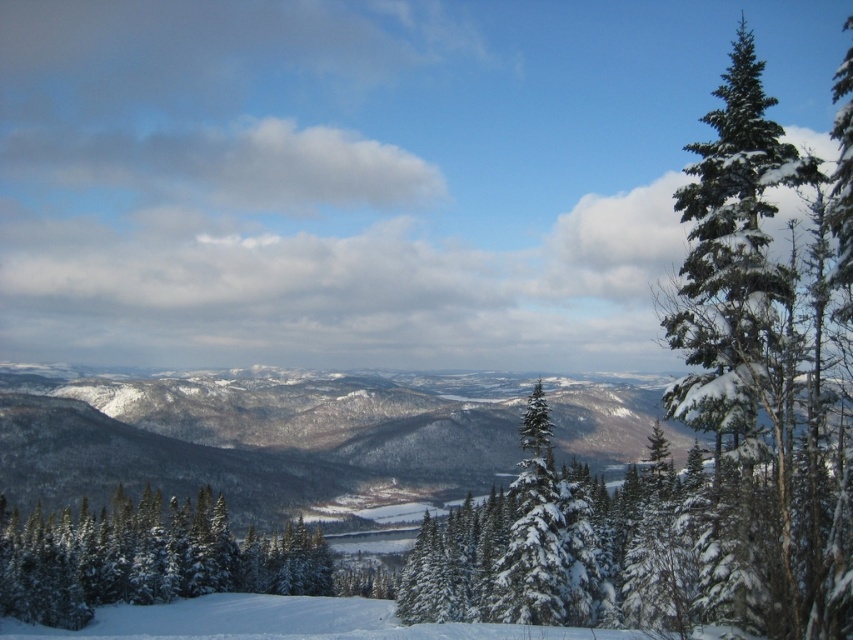
Can you confirm if green snow-covered evergreen at right is positioned to the left of white snow-covered trees at lower left?

No, green snow-covered evergreen at right is not to the left of white snow-covered trees at lower left.

Can you confirm if green snow-covered evergreen at right is smaller than white snow-covered trees at lower left?

No, green snow-covered evergreen at right is not smaller than white snow-covered trees at lower left.

At what (x,y) coordinates should I click in order to perform the action: click on green snow-covered evergreen at right. Please return your answer as a coordinate pair (x, y). Looking at the image, I should click on (735, 273).

Who is more forward, (222, 499) or (177, 605)?

Point (177, 605)

Does white snow-covered trees at lower left have a lesser height compared to white snow ski slope at lower center?

Yes, white snow-covered trees at lower left is shorter than white snow ski slope at lower center.

Is point (166, 513) closer to viewer compared to point (354, 621)?

No, (166, 513) is further to viewer.

You are a GUI agent. You are given a task and a screenshot of the screen. Output one action in this format:
    pyautogui.click(x=<x>, y=<y>)
    Task: Click on the white snow-covered trees at lower left
    This screenshot has width=853, height=640.
    Given the screenshot: What is the action you would take?
    pyautogui.click(x=146, y=557)

Is green snow-covered evergreen at right further to camera compared to white snow ski slope at lower center?

No, green snow-covered evergreen at right is in front of white snow ski slope at lower center.

Which is in front, point (683, 272) or point (53, 628)?

Point (683, 272)

Image resolution: width=853 pixels, height=640 pixels. In order to click on green snow-covered evergreen at right in this screenshot , I will do `click(735, 273)`.